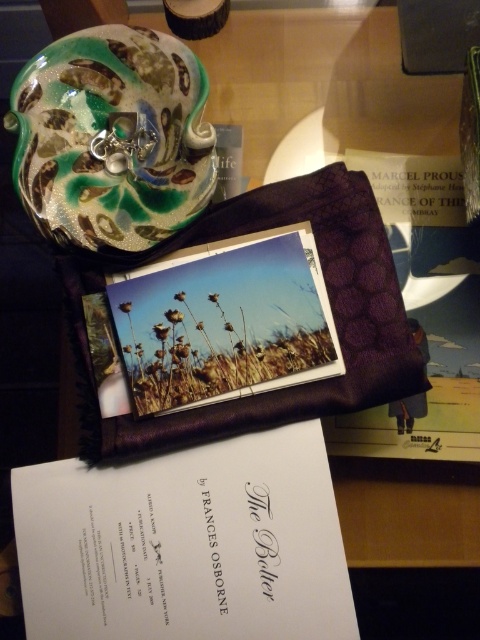
Question: Can you confirm if shiny ceramic plate at upper left is positioned to the left of purple quilted folder at center?

Choices:
 (A) yes
 (B) no

Answer: (A)

Question: Which of the following is the closest to the observer?

Choices:
 (A) shiny ceramic plate at upper left
 (B) purple quilted folder at center

Answer: (B)

Question: Does shiny ceramic plate at upper left have a larger size compared to purple quilted folder at center?

Choices:
 (A) no
 (B) yes

Answer: (A)

Question: Which point appears farthest from the camera in this image?

Choices:
 (A) (60, 272)
 (B) (96, 170)

Answer: (B)

Question: Does shiny ceramic plate at upper left come behind purple quilted folder at center?

Choices:
 (A) yes
 (B) no

Answer: (A)

Question: Among these points, which one is nearest to the camera?

Choices:
 (A) (155, 116)
 (B) (182, 429)

Answer: (B)